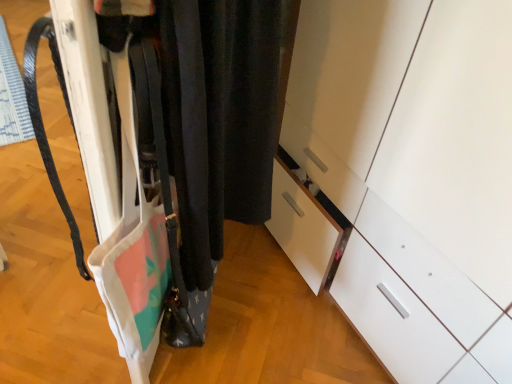
Image resolution: width=512 pixels, height=384 pixels. Identify the location of vacant space in white matte closet at center (from a real-world perspective). (223, 315).